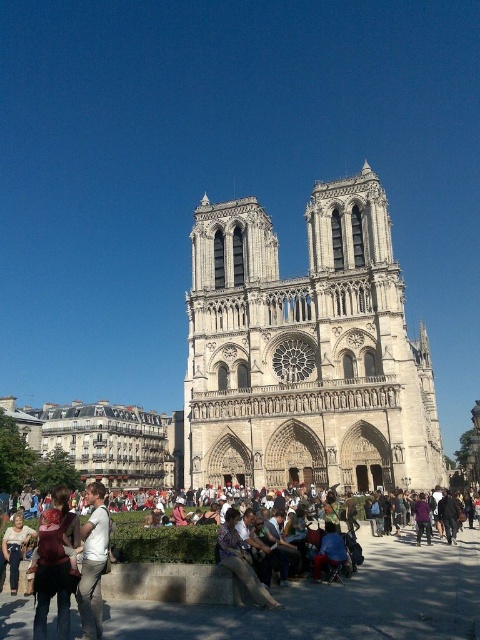
In the scene shown: You are a photographer standing in front of Notre Dame Cathedral. You see a white cotton shirt at lower left and a leather jacket at center. Which clothing item is taller?

The white cotton shirt at lower left is much taller than the leather jacket at center.

You are standing in the square in front of Notre Dame Cathedral and see a person wearing a white cotton shirt at lower left. If you want to find this person, in which direction relative to the cathedral should you look?

The white cotton shirt at lower left is located at point 0.880 on the x axis and 0.194 on the y axis, so you should look to the lower left direction relative to the cathedral to find the person wearing the white cotton shirt at lower left.

You are a tourist standing in front of Notre Dame Cathedral and you see a denim jacket at lower center and a leather jacket at center. Which jacket is positioned lower in the image?

The denim jacket at lower center is positioned lower than the leather jacket at center.